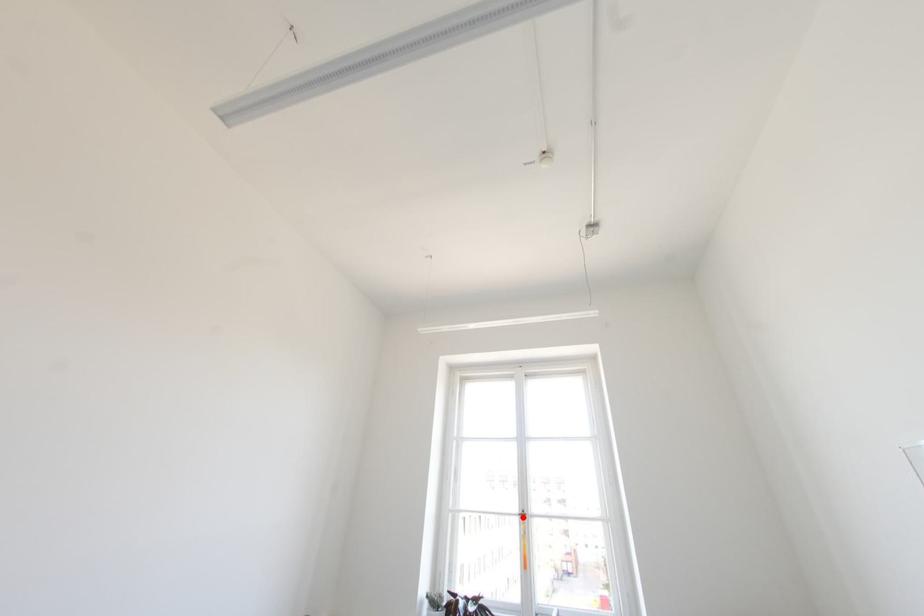
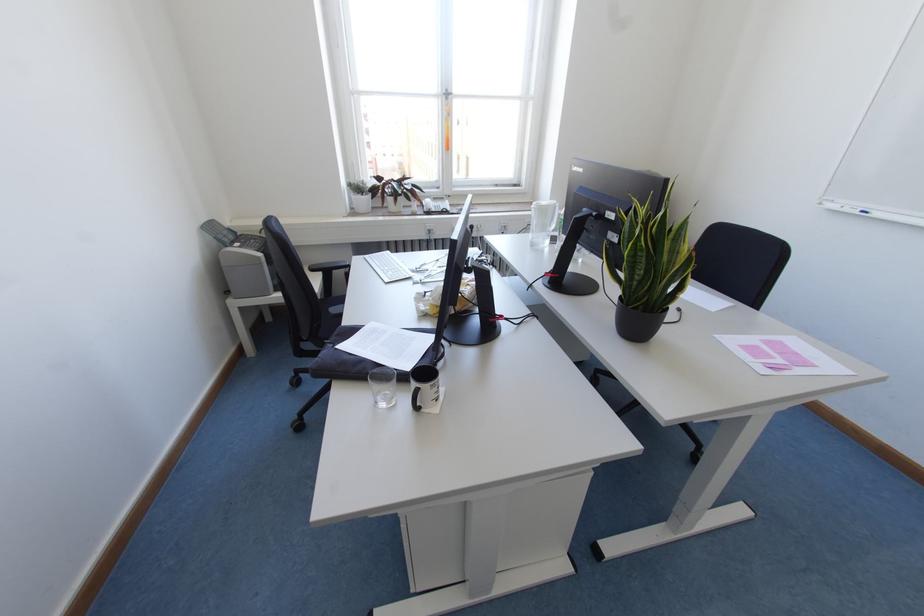
Find the pixel in the second image that matches the highlighted location in the first image.

(446, 98)